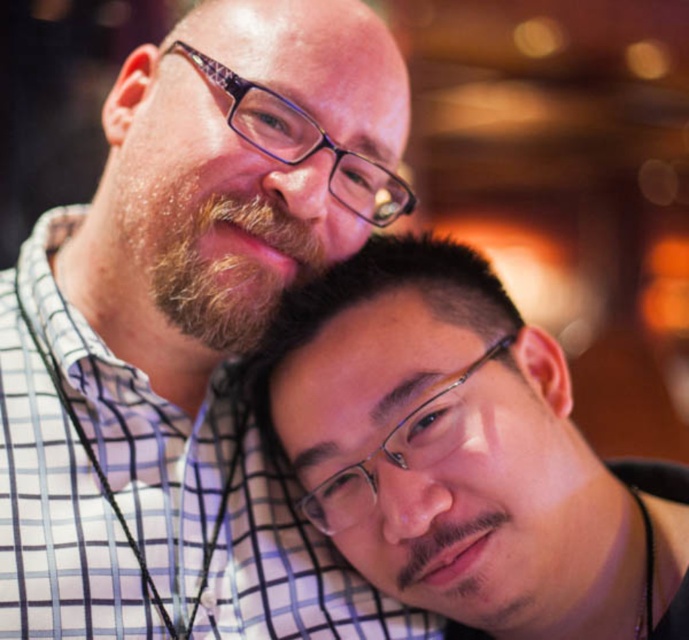
Does matte black glasses at lower right have a lesser width compared to brown fuzzy beard at upper left?

In fact, matte black glasses at lower right might be wider than brown fuzzy beard at upper left.

Can you confirm if matte black glasses at lower right is positioned below brown fuzzy beard at upper left?

Correct, matte black glasses at lower right is located below brown fuzzy beard at upper left.

Image resolution: width=689 pixels, height=640 pixels. What are the coordinates of `matte black glasses at lower right` in the screenshot? It's located at (464, 454).

Looking at this image, who is more forward, (176, 92) or (347, 364)?

Point (347, 364) is in front.

Find the location of a particular element. The width and height of the screenshot is (689, 640). matte black shirt at upper left is located at coordinates (192, 332).

The width and height of the screenshot is (689, 640). What do you see at coordinates (192, 332) in the screenshot?
I see `matte black shirt at upper left` at bounding box center [192, 332].

This screenshot has width=689, height=640. What are the coordinates of `matte black shirt at upper left` in the screenshot? It's located at (192, 332).

Is matte black shirt at upper left to the right of brown fuzzy beard at upper left from the viewer's perspective?

Yes, matte black shirt at upper left is to the right of brown fuzzy beard at upper left.

Between point (305, 140) and point (187, 252), which one is positioned in front?

Positioned in front is point (187, 252).

Locate an element on the screen. matte black shirt at upper left is located at coordinates (192, 332).